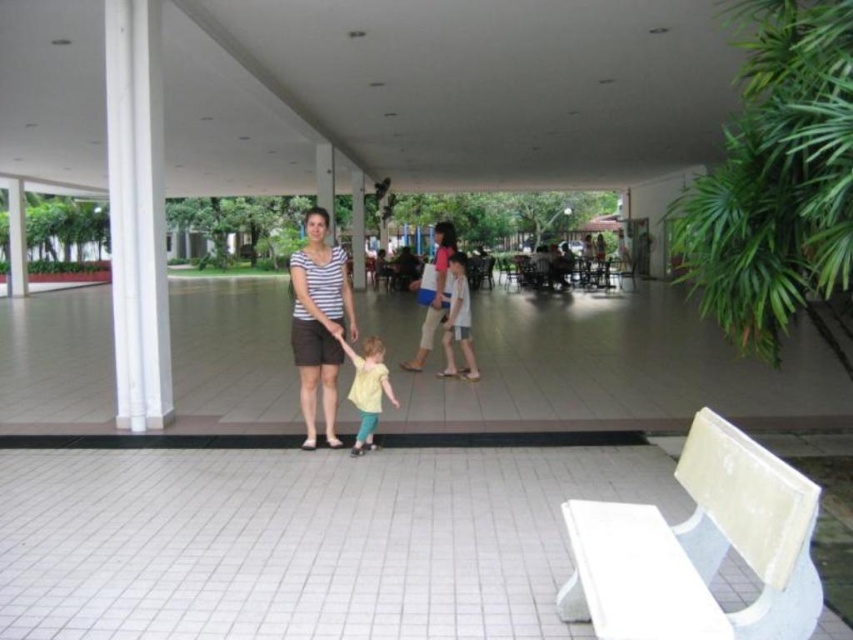
Question: Is striped cotton shirt at center to the left of yellow matte shirt at center from the viewer's perspective?

Choices:
 (A) yes
 (B) no

Answer: (A)

Question: Among these objects, which one is farthest from the camera?

Choices:
 (A) matte pink shirt at center
 (B) striped cotton shirt at center
 (C) yellow matte shirt at center

Answer: (A)

Question: Can you confirm if yellow matte shirt at center is positioned above matte pink shirt at center?

Choices:
 (A) yes
 (B) no

Answer: (B)

Question: Is the position of yellow matte shirt at center more distant than that of light blue denim shorts at center?

Choices:
 (A) yes
 (B) no

Answer: (B)

Question: Which of these objects is positioned farthest from the yellow matte shirt at center?

Choices:
 (A) matte pink shirt at center
 (B) light blue denim shorts at center

Answer: (A)

Question: Which point is closer to the camera?

Choices:
 (A) yellow matte shirt at center
 (B) striped cotton shirt at center

Answer: (A)